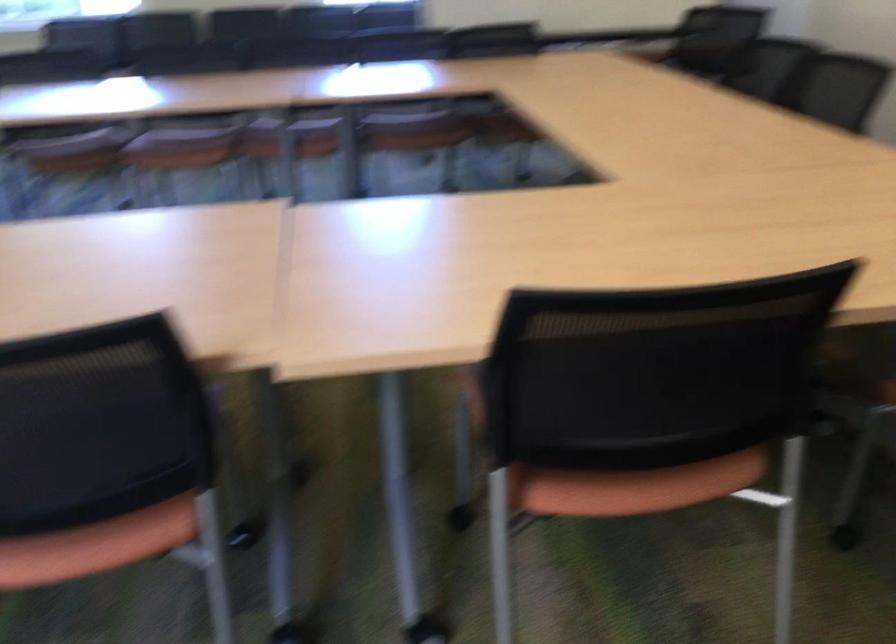
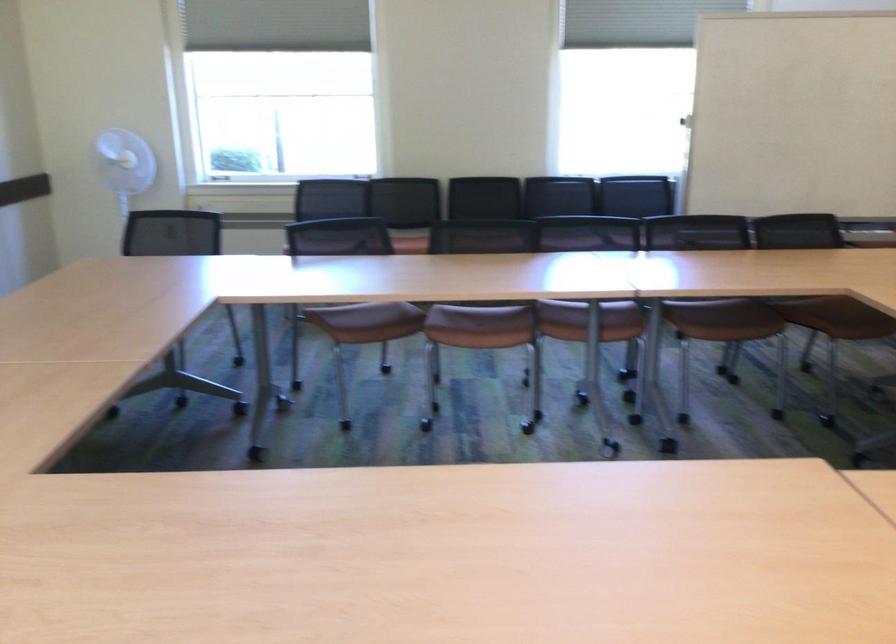
Where in the second image is the point corresponding to [236,97] from the first image?

(590, 292)